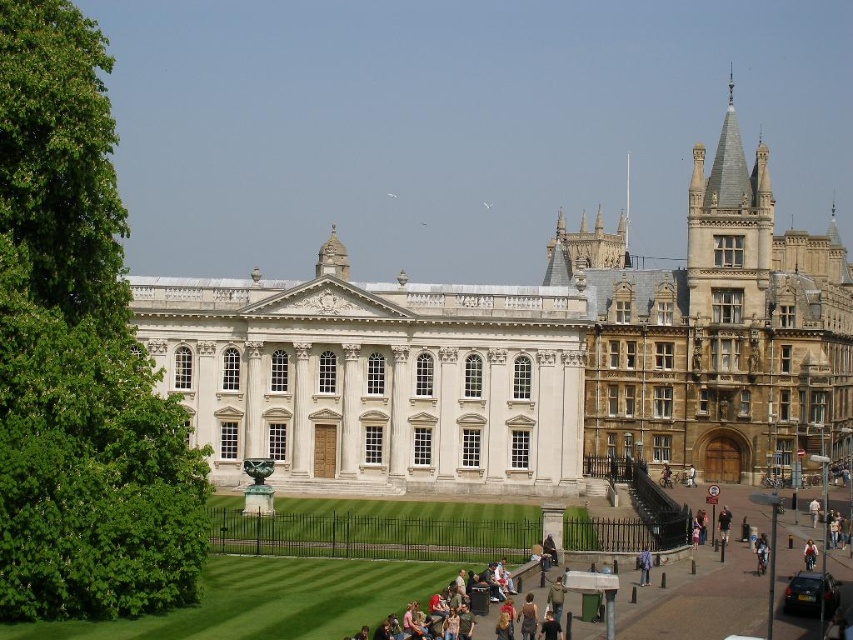
Can you confirm if white polished stone building at center is positioned to the left of black fabric jacket at lower right?

Correct, you'll find white polished stone building at center to the left of black fabric jacket at lower right.

This screenshot has height=640, width=853. I want to click on white polished stone building at center, so click(x=375, y=378).

What do you see at coordinates (375, 378) in the screenshot? The image size is (853, 640). I see `white polished stone building at center` at bounding box center [375, 378].

Find the location of a particular element. The image size is (853, 640). white polished stone building at center is located at coordinates (375, 378).

Is purple fabric jacket at lower center closer to the viewer compared to white cotton shirt at center?

Yes, it is.

Does purple fabric jacket at lower center lie behind white cotton shirt at center?

No, purple fabric jacket at lower center is in front of white cotton shirt at center.

The height and width of the screenshot is (640, 853). What do you see at coordinates (643, 564) in the screenshot? I see `purple fabric jacket at lower center` at bounding box center [643, 564].

The image size is (853, 640). I want to click on purple fabric jacket at lower center, so click(643, 564).

Between brown stone building at right and denim jacket at lower right, which one is positioned lower?

Positioned lower is denim jacket at lower right.

How much distance is there between brown stone building at right and denim jacket at lower right?

The distance of brown stone building at right from denim jacket at lower right is 108.17 feet.

Is point (840, 365) farther from viewer compared to point (804, 560)?

Yes, it is.

Identify the location of brown stone building at right. This screenshot has width=853, height=640. (715, 332).